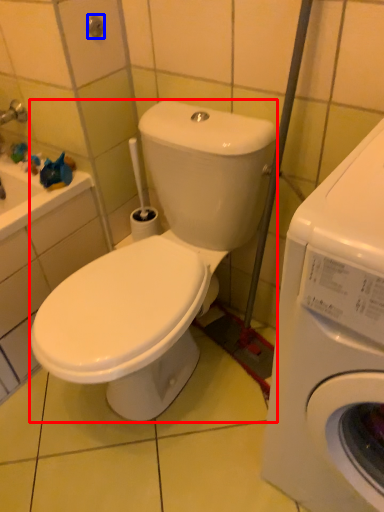
Question: Among these objects, which one is farthest to the camera, washing machine (highlighted by a red box) or shower (highlighted by a blue box)?

Choices:
 (A) washing machine
 (B) shower

Answer: (B)